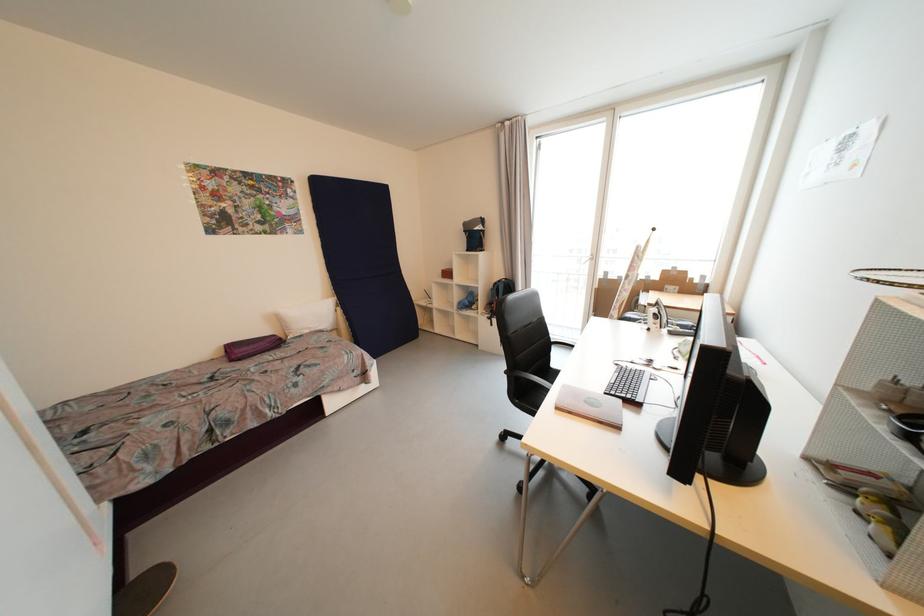
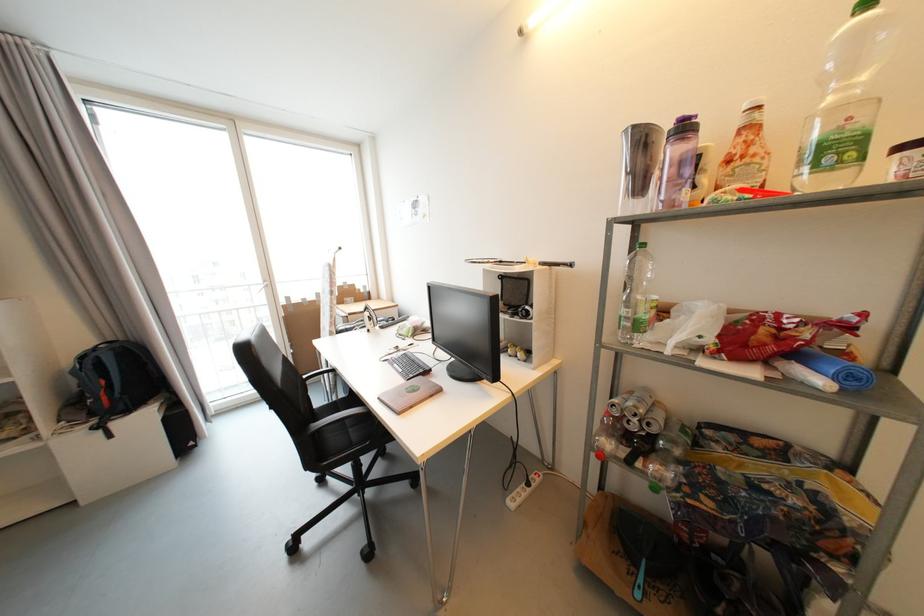
Find the pixel in the second image that matches (634,399) in the first image.

(427, 373)